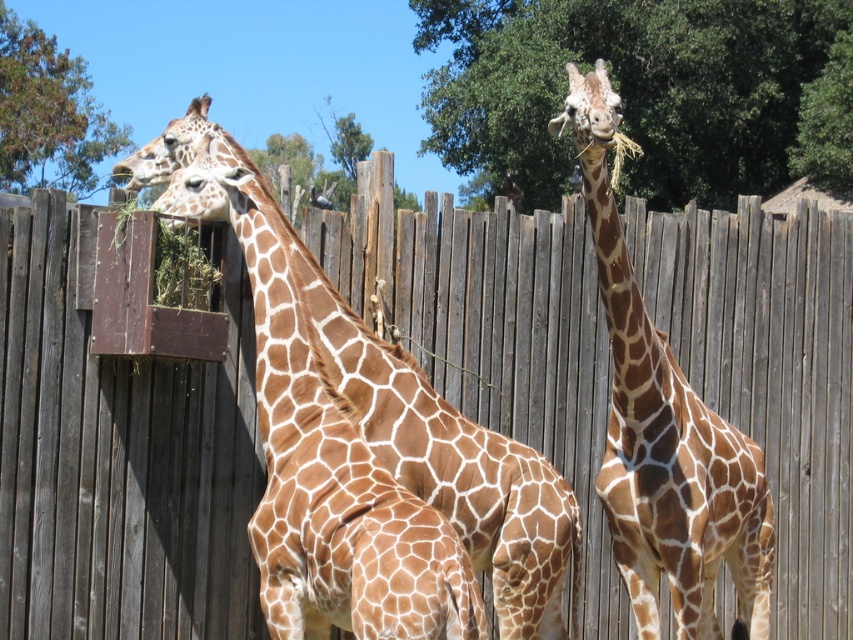
You are a zookeeper who needs to ensure all animals are visible to visitors. The enclosure has a viewing area at the left side. Considering the brown spotted giraffe at right and the green grass at left, which object might block the view of the giraffe from the left side?

The brown spotted giraffe at right is bigger than the green grass at left, so the giraffe might block the view of the green grass at left from the left side.

You are standing at the point marked as point (x=276, y=230) in the zoo enclosure. You want to take a photo of the giraffes without getting too close. The camera you are using has a maximum range of 20 feet. Can you capture the giraffes clearly from your current position?

The distance between point (x=276, y=230) and the camera is 19.26 feet, which is within the camera maximum range of 20 feet. Therefore, you can capture the giraffes clearly from your current position.

You are standing at the point marked by the coordinate point at (x=314, y=438) in the image. Looking around, you see a brown spotted giraffe at left. Which direction should you move to get closer to the brown spotted giraffe at left?

Since the point at (x=314, y=438) marks the location of the brown spotted giraffe at left, you are already at the position of the giraffe. No movement is needed to get closer.